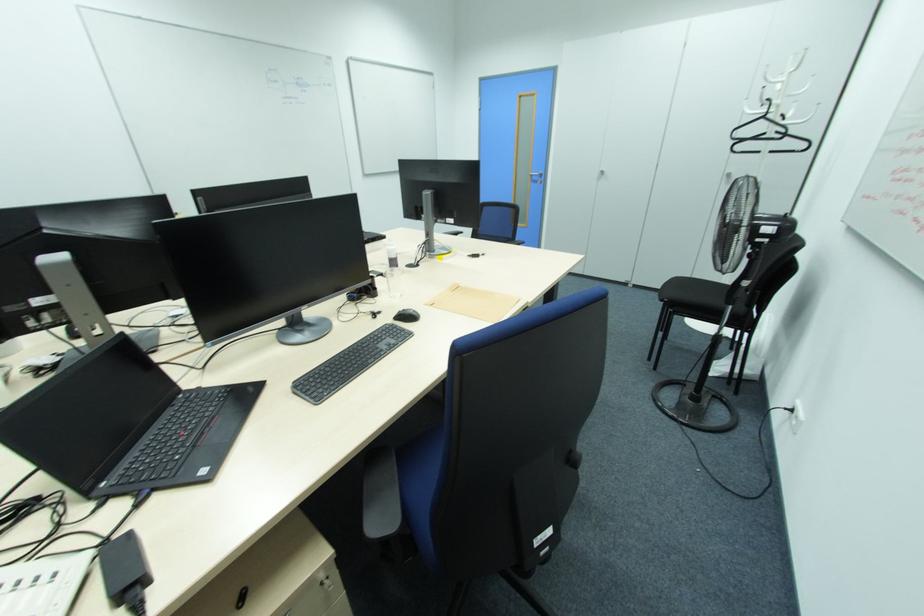
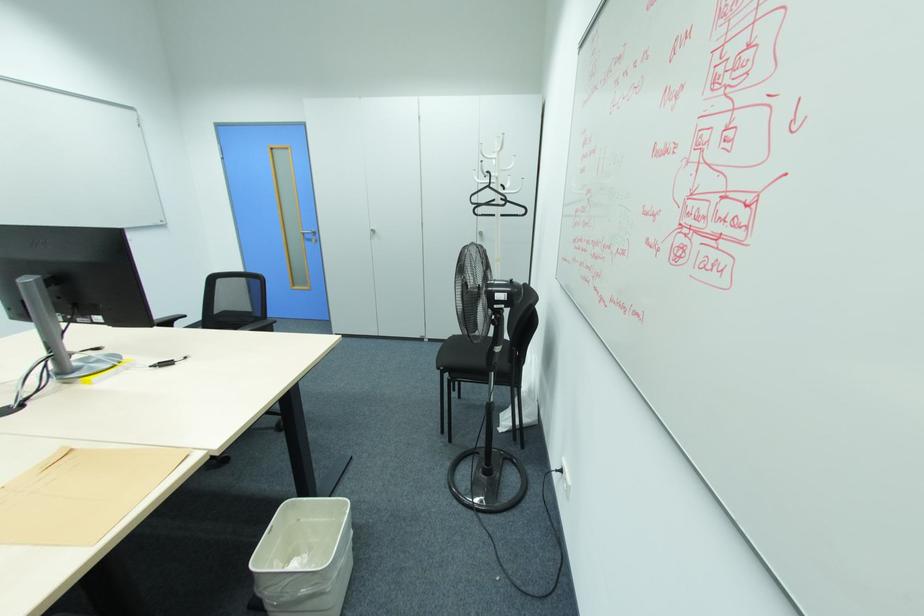
The point at (541, 175) is marked in the first image. Where is the corresponding point in the second image?

(314, 233)